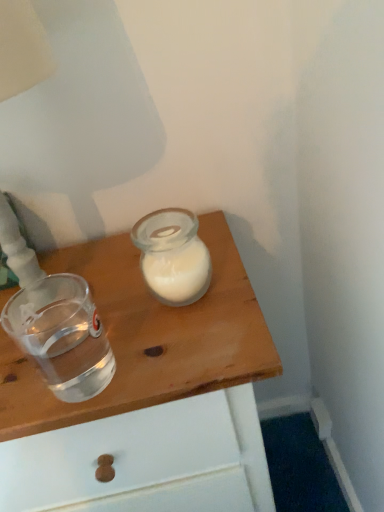
Question: Looking at their shapes, would you say transparent glass at upper center is wider or thinner than transparent plastic shot glass at left?

Choices:
 (A) wide
 (B) thin

Answer: (A)

Question: Is transparent glass at upper center taller or shorter than transparent plastic shot glass at left?

Choices:
 (A) tall
 (B) short

Answer: (A)

Question: From a real-world perspective, is transparent glass at upper center above or below transparent plastic shot glass at left?

Choices:
 (A) below
 (B) above

Answer: (A)

Question: Choose the correct answer: Is transparent plastic shot glass at left inside transparent glass at upper center or outside it?

Choices:
 (A) outside
 (B) inside

Answer: (A)

Question: Considering the relative positions of transparent plastic shot glass at left and transparent glass at upper center in the image provided, is transparent plastic shot glass at left to the left or to the right of transparent glass at upper center?

Choices:
 (A) left
 (B) right

Answer: (A)

Question: Is transparent plastic shot glass at left bigger or smaller than transparent glass at upper center?

Choices:
 (A) big
 (B) small

Answer: (B)

Question: From a real-world perspective, is transparent plastic shot glass at left positioned above or below transparent glass at upper center?

Choices:
 (A) below
 (B) above

Answer: (B)